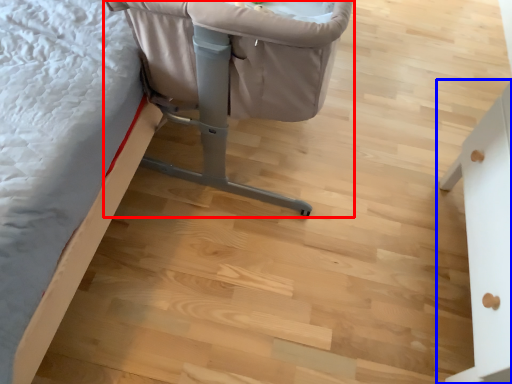
Question: Which object is further to the camera taking this photo, furniture (highlighted by a red box) or furniture (highlighted by a blue box)?

Choices:
 (A) furniture
 (B) furniture

Answer: (A)